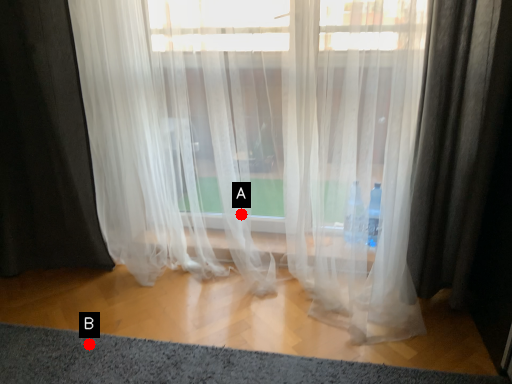
Question: Two points are circled on the image, labeled by A and B beside each circle. Which point is farther to the camera?

Choices:
 (A) A is further
 (B) B is further

Answer: (A)